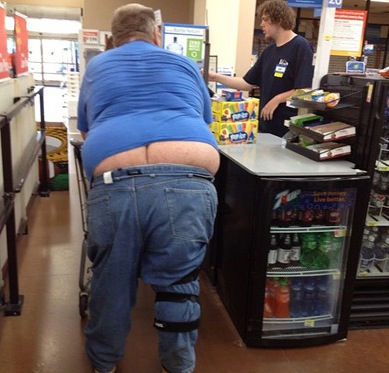
The image size is (389, 373). In order to click on floor in this screenshot , I will do `click(61, 311)`.